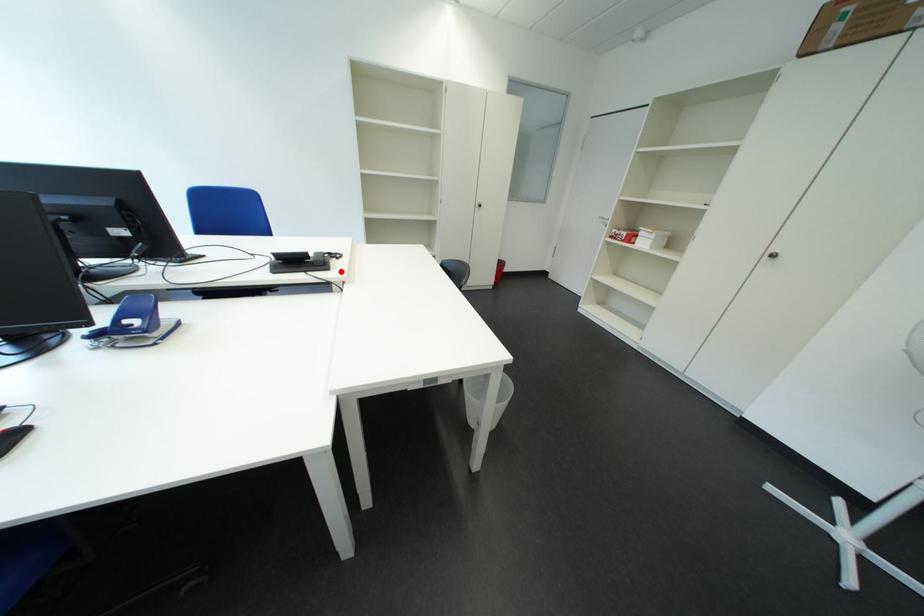
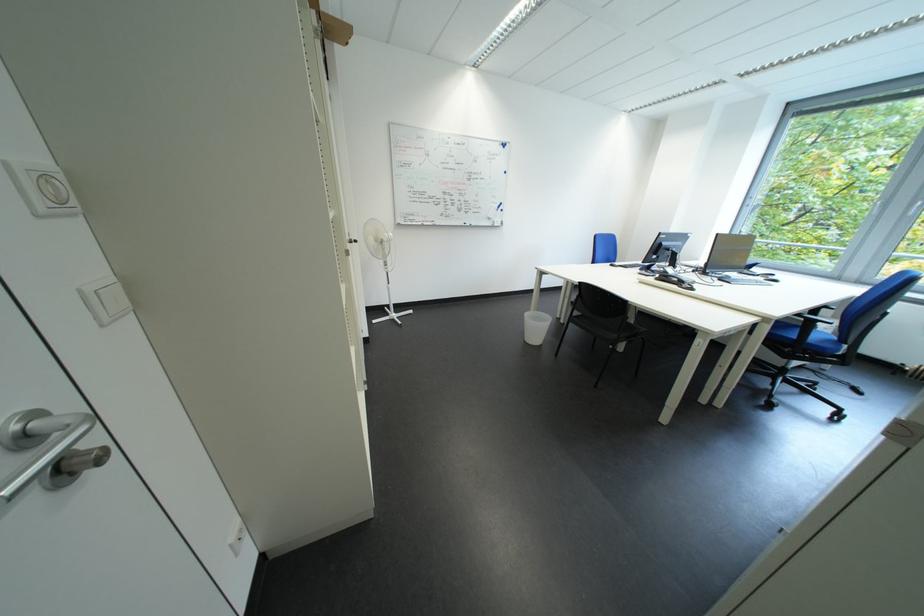
Question: I am providing you with two images of the same scene from different viewpoints. Image1 has a red point marked. In image2, the corresponding 3D location appears at what relative position? Reply with the corresponding letter.

Choices:
 (A) Closer
 (B) Farther

Answer: (A)